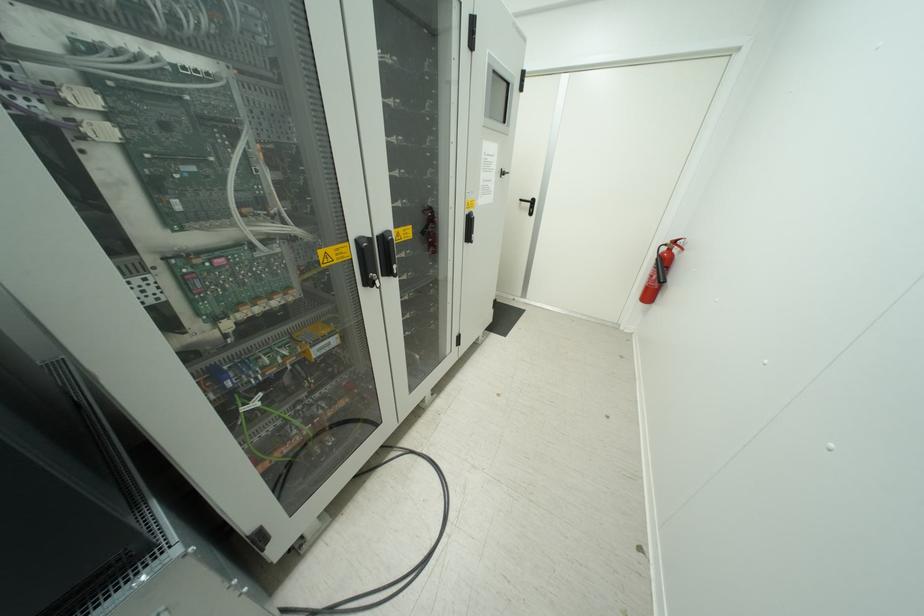
At what (x,y) coordinates should I click in order to perform the action: click on black door handle. Please return your answer as a coordinate pair (x, y). The height and width of the screenshot is (616, 924). Looking at the image, I should click on (367, 261).